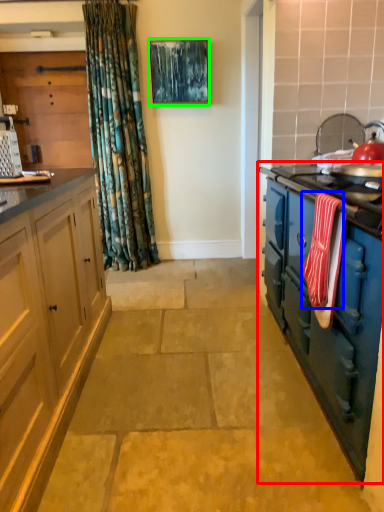
Question: Which is farther away from cabinetry (highlighted by a red box)? material (highlighted by a blue box) or picture frame (highlighted by a green box)?

Choices:
 (A) material
 (B) picture frame

Answer: (B)